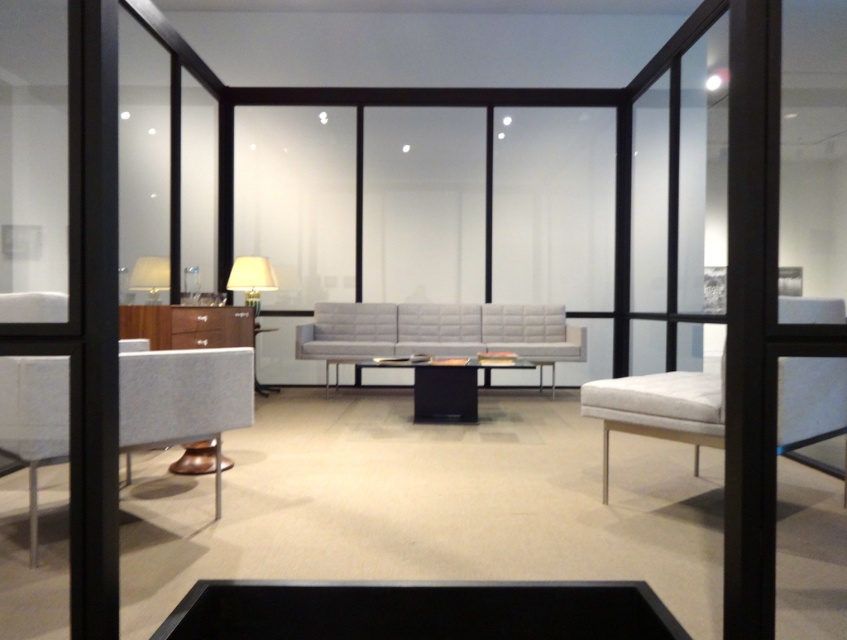
Does textured gray chair at left appear on the right side of white fabric armchair at right?

In fact, textured gray chair at left is to the left of white fabric armchair at right.

Which is behind, point (32, 387) or point (595, 412)?

Positioned behind is point (595, 412).

Is point (29, 524) farther from viewer compared to point (702, 406)?

Yes, it is.

The height and width of the screenshot is (640, 847). I want to click on textured gray chair at left, so click(181, 396).

Can you confirm if black glossy table at center is smaller than matte white lampshade at upper left?

Yes, black glossy table at center is smaller than matte white lampshade at upper left.

Who is taller, black glossy table at center or matte white lampshade at upper left?

black glossy table at center

Describe the element at coordinates (446, 385) in the screenshot. I see `black glossy table at center` at that location.

Identify the location of black glossy table at center. The height and width of the screenshot is (640, 847). (446, 385).

Between white fabric armchair at right and matte white lamp at upper center, which one appears on the right side from the viewer's perspective?

white fabric armchair at right

The image size is (847, 640). What are the coordinates of `white fabric armchair at right` in the screenshot? It's located at (659, 408).